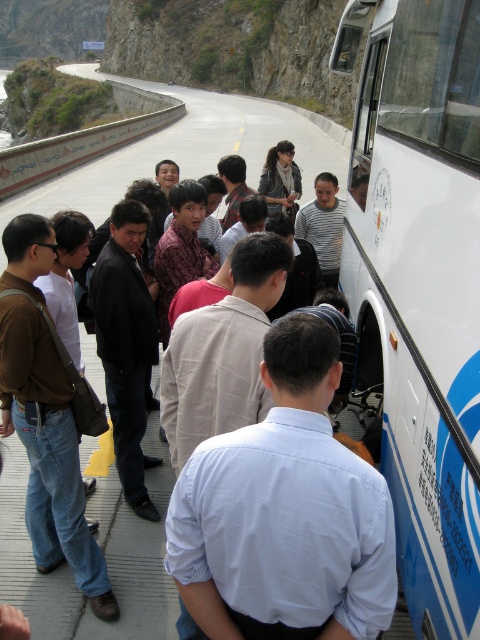
Can you confirm if light blue shirt at center is smaller than black smooth suit at center?

Correct, light blue shirt at center occupies less space than black smooth suit at center.

How much distance is there between light blue shirt at center and black smooth suit at center?

light blue shirt at center and black smooth suit at center are 7.71 feet apart.

Is point (295, 460) positioned in front of point (157, 465)?

Yes, point (295, 460) is closer to viewer.

Find the location of a particular element. light blue shirt at center is located at coordinates (285, 513).

From the picture: Does matte white bus at right have a lesser height compared to black smooth suit at center?

In fact, matte white bus at right may be taller than black smooth suit at center.

Who is shorter, matte white bus at right or black smooth suit at center?

black smooth suit at center

Describe the element at coordinates (103, 550) in the screenshot. This screenshot has height=640, width=480. I see `matte white bus at right` at that location.

Locate an element on the screen. matte white bus at right is located at coordinates (103, 550).

Who is more forward, (63, 497) or (283, 195)?

Point (63, 497)

Who is lower down, brown denim jeans at left or dark gray leather jacket at center?

brown denim jeans at left is below.

Describe the element at coordinates (48, 451) in the screenshot. I see `brown denim jeans at left` at that location.

Locate an element on the screen. brown denim jeans at left is located at coordinates (48, 451).